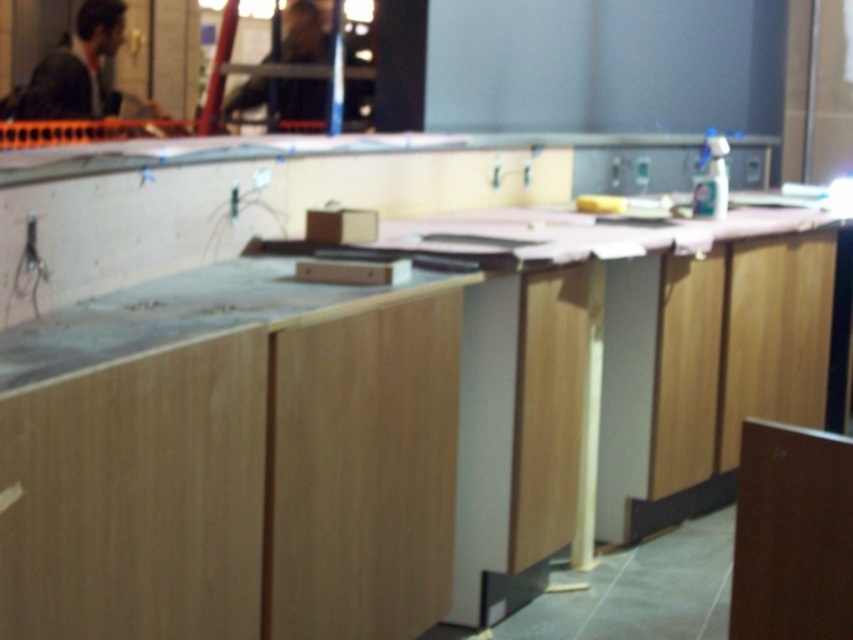
You are standing at the point marked by coordinates (x=288, y=452) in the construction site. What object are you standing on?

You are standing on the wooden counter at center, which is represented by the point coordinates (x=288, y=452).

You are a contractor assessing a construction site. You see the wooden counter at center and the dark brown leather jacket at upper center. Which object takes up more space in the image?

The wooden counter at center is larger in size than the dark brown leather jacket at upper center, so it takes up more space in the image.

You are a contractor observing the construction site. You notice the matte black suit at upper left and the dark brown leather jacket at upper center. Which clothing item is taller?

The matte black suit at upper left is taller than the dark brown leather jacket at upper center according to the description.